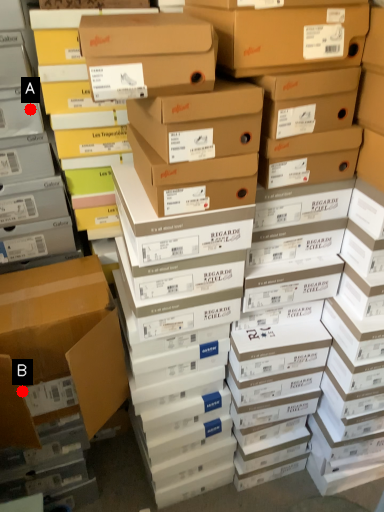
Question: Two points are circled on the image, labeled by A and B beside each circle. Which point is farther from the camera taking this photo?

Choices:
 (A) A is further
 (B) B is further

Answer: (B)